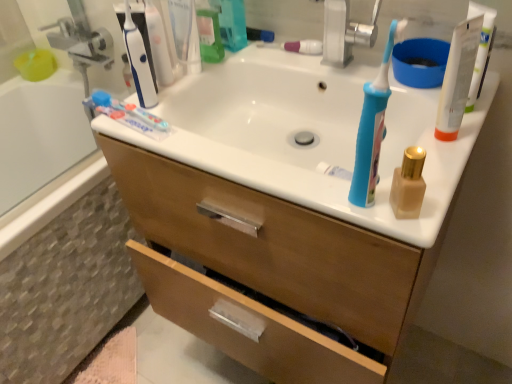
Question: Is silver metallic faucet at upper center positioned before white glossy toothpaste at upper left, placed as the second toothpaste when sorted from right to left?

Choices:
 (A) no
 (B) yes

Answer: (A)

Question: Can you confirm if silver metallic faucet at upper center is shorter than white glossy toothpaste at upper left, which is counted as the second toothpaste, starting from the top?

Choices:
 (A) no
 (B) yes

Answer: (A)

Question: From a real-world perspective, is silver metallic faucet at upper center under white glossy toothpaste at upper left, positioned as the 1th toothpaste in front-to-back order?

Choices:
 (A) yes
 (B) no

Answer: (B)

Question: Could you tell me if silver metallic faucet at upper center is turned towards white glossy toothpaste at upper left, which is counted as the second toothpaste, starting from the top?

Choices:
 (A) yes
 (B) no

Answer: (B)

Question: Considering the relative positions of silver metallic faucet at upper center and white glossy toothpaste at upper left, which is the first toothpaste in left-to-right order, in the image provided, is silver metallic faucet at upper center to the right of white glossy toothpaste at upper left, which is the first toothpaste in left-to-right order, from the viewer's perspective?

Choices:
 (A) no
 (B) yes

Answer: (B)

Question: Can you confirm if silver metallic faucet at upper center is taller than white glossy toothpaste at upper left, which is counted as the second toothpaste, starting from the top?

Choices:
 (A) yes
 (B) no

Answer: (A)

Question: Can you confirm if white glossy toothpaste at upper left, which is counted as the second toothpaste, starting from the top, is taller than matte gold bottle at right?

Choices:
 (A) no
 (B) yes

Answer: (A)

Question: Is white glossy toothpaste at upper left, which is the first toothpaste in left-to-right order, bigger than matte gold bottle at right?

Choices:
 (A) no
 (B) yes

Answer: (B)

Question: Is white glossy toothpaste at upper left, arranged as the 2th toothpaste when viewed from the back, completely or partially outside of matte gold bottle at right?

Choices:
 (A) yes
 (B) no

Answer: (A)

Question: From a real-world perspective, is white glossy toothpaste at upper left, which is counted as the second toothpaste, starting from the top, below matte gold bottle at right?

Choices:
 (A) yes
 (B) no

Answer: (A)

Question: Is white glossy toothpaste at upper left, positioned as the 1th toothpaste in front-to-back order, to the right of matte gold bottle at right from the viewer's perspective?

Choices:
 (A) no
 (B) yes

Answer: (A)

Question: Is matte gold bottle at right turned away from white glossy toothpaste at upper left, which is the first toothpaste in left-to-right order?

Choices:
 (A) yes
 (B) no

Answer: (B)